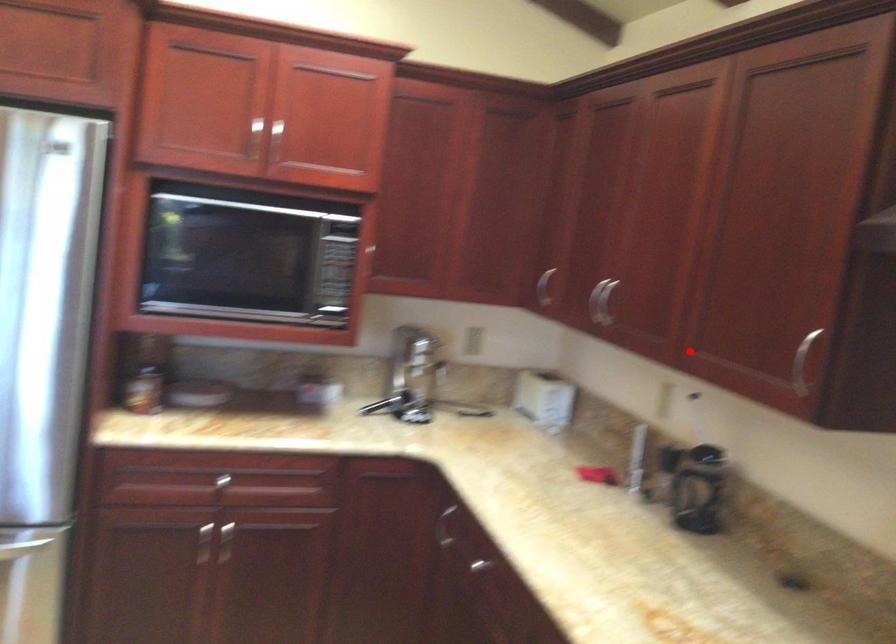
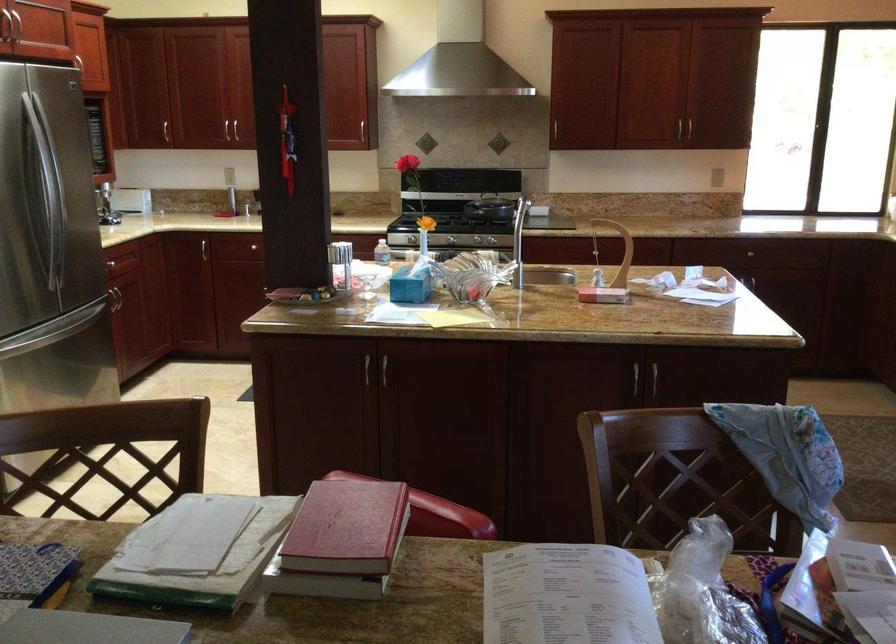
Find the pixel in the second image that matches the highlighted location in the first image.

(231, 131)